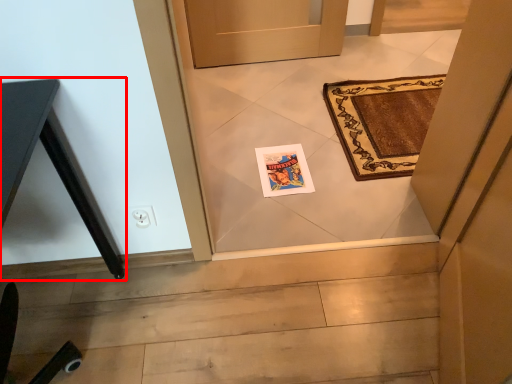
Question: Where is table (annotated by the red box) located in relation to postcard in the image?

Choices:
 (A) left
 (B) right

Answer: (A)